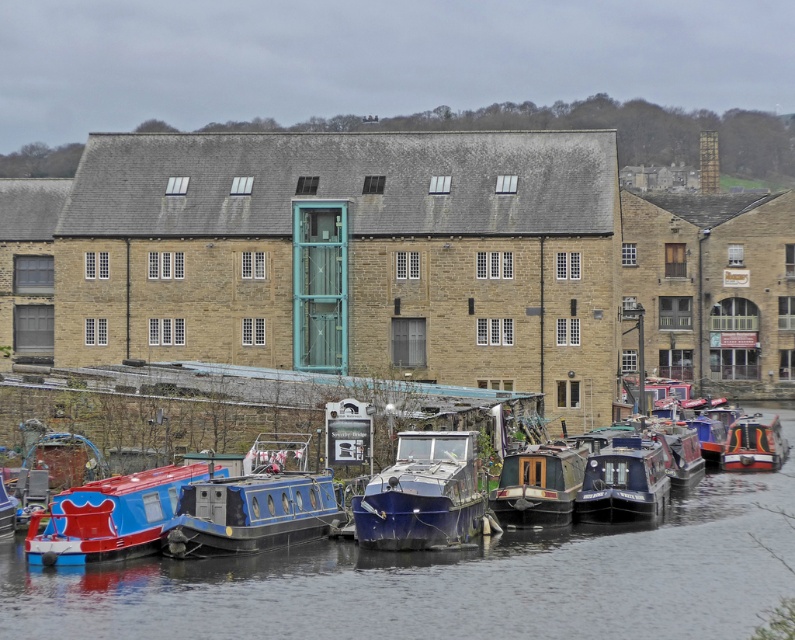
Looking at this image, can you confirm if shiny blue boat at lower left is shorter than blue glossy boat at center?

Correct, shiny blue boat at lower left is not as tall as blue glossy boat at center.

Is point (99, 486) positioned behind point (700, 445)?

No, it is not.

You are a GUI agent. You are given a task and a screenshot of the screen. Output one action in this format:
    pyautogui.click(x=<x>, y=<y>)
    Task: Click on the shiny blue boat at lower left
    
    Given the screenshot: What is the action you would take?
    pyautogui.click(x=111, y=516)

Consider the image. Who is positioned more to the right, blue glossy boats at lower center or blue glossy boat at lower left?

Positioned to the right is blue glossy boats at lower center.

Looking at this image, is blue glossy boats at lower center closer to camera compared to blue glossy boat at lower left?

Yes.

The width and height of the screenshot is (795, 640). What do you see at coordinates (448, 580) in the screenshot?
I see `blue glossy boats at lower center` at bounding box center [448, 580].

This screenshot has width=795, height=640. In order to click on blue glossy boats at lower center in this screenshot , I will do pos(448,580).

From the picture: Is blue matte boat at center thinner than metallic blue boat at center?

No.

Does blue matte boat at center appear over metallic blue boat at center?

Yes.

Between point (304, 484) and point (433, 445), which one is positioned in front?

Point (304, 484) is more forward.

Locate an element on the screen. The image size is (795, 640). blue matte boat at center is located at coordinates (258, 502).